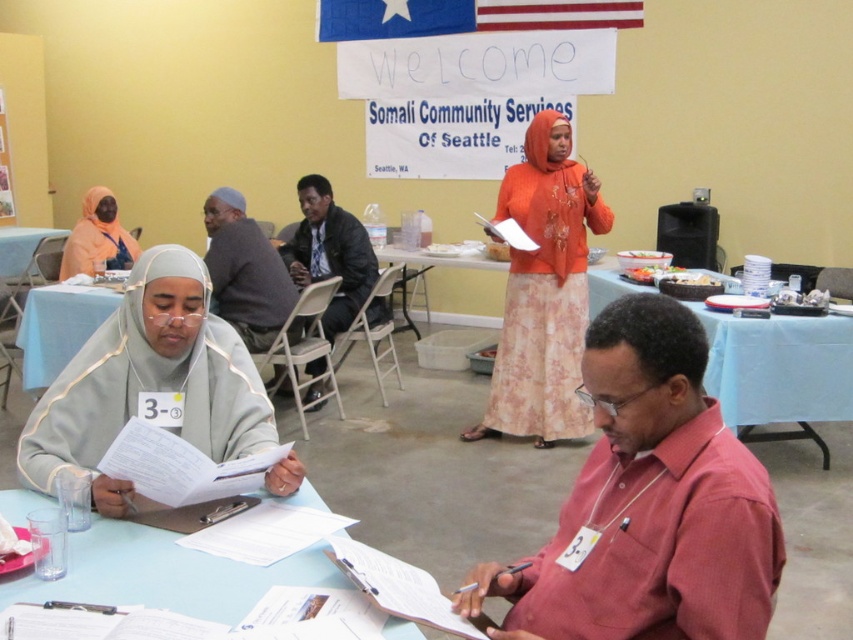
Question: Does light gray fabric hijab at left appear over orange floral dress at center?

Choices:
 (A) no
 (B) yes

Answer: (A)

Question: Which of the following is the closest to the observer?

Choices:
 (A) (822, 358)
 (B) (68, 268)
 (C) (3, 221)
 (D) (57, 243)

Answer: (A)

Question: Which of the following is the closest to the observer?

Choices:
 (A) matte orange hijab at upper left
 (B) white paper at lower center
 (C) blue fabric table at center
 (D) pink woven shirt at lower right

Answer: (D)

Question: Can you confirm if pink woven shirt at lower right is positioned above blue fabric table at lower left?

Choices:
 (A) yes
 (B) no

Answer: (B)

Question: Which point is closer to the camera?

Choices:
 (A) (554, 244)
 (B) (704, 312)
 (C) (100, 269)
 (D) (354, 268)

Answer: (B)

Question: In this image, where is blue fabric table at center located relative to blue plastic table at left?

Choices:
 (A) above
 (B) below

Answer: (B)